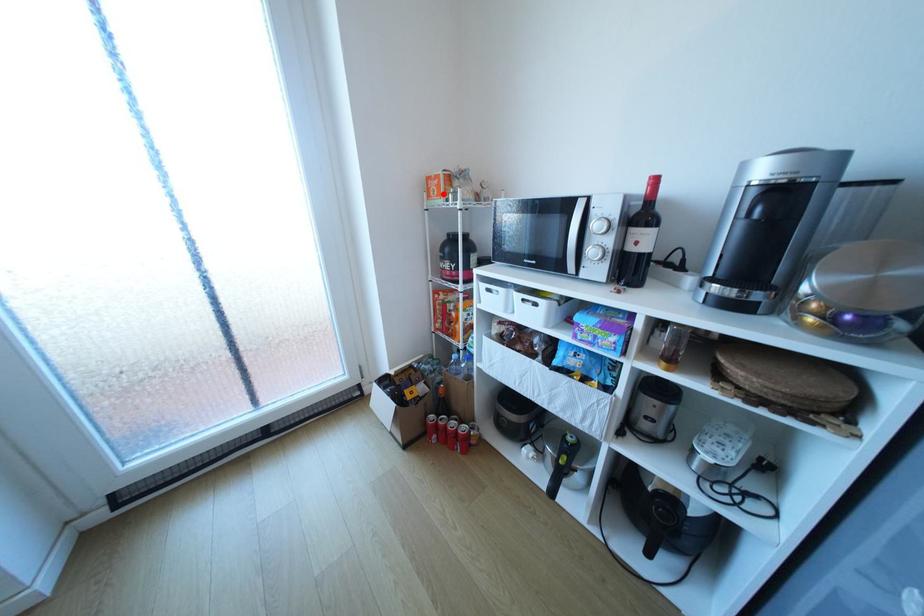
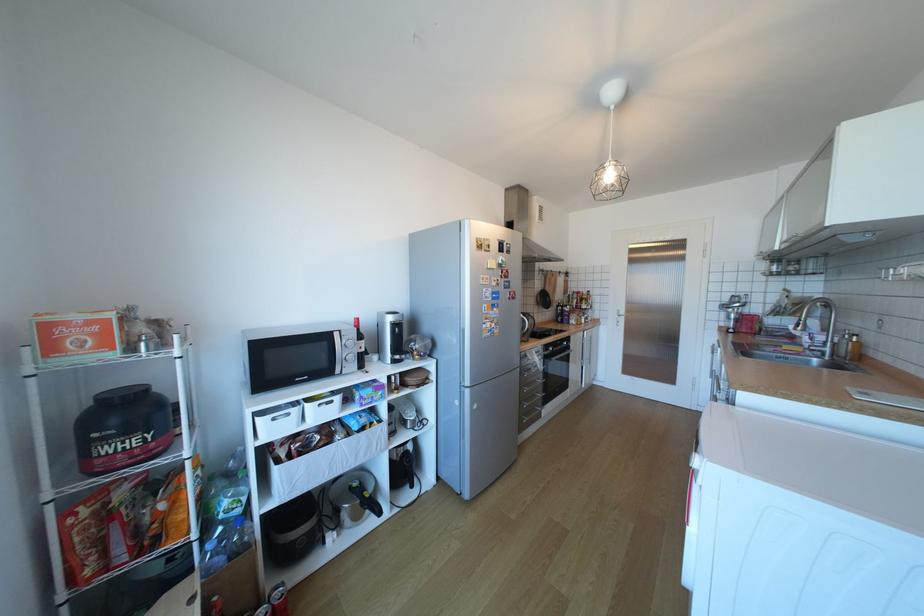
Find the pixel in the second image that matches the highlighted location in the first image.

(91, 346)